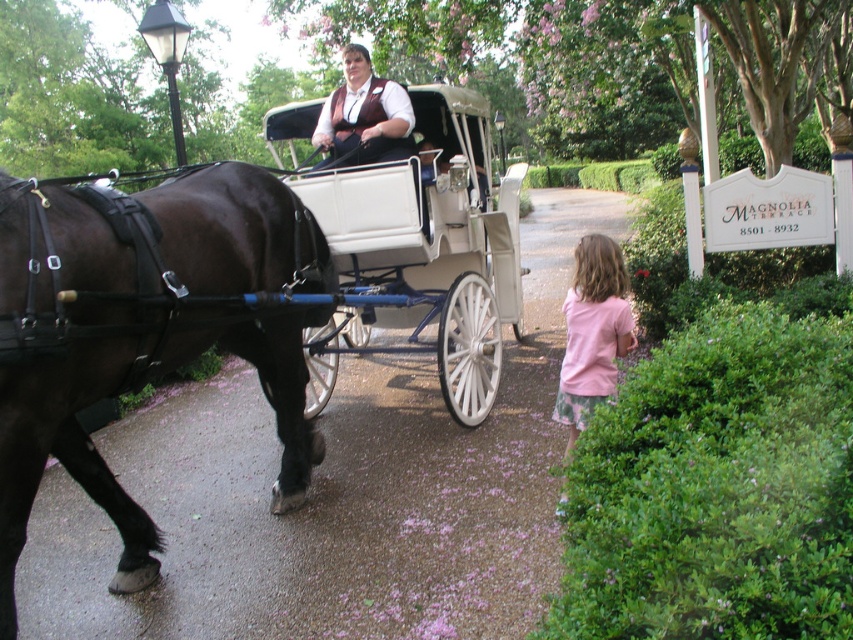
Does shiny black horse at left appear under pink cotton shirt at lower right?

No, shiny black horse at left is not below pink cotton shirt at lower right.

What do you see at coordinates (146, 330) in the screenshot? This screenshot has height=640, width=853. I see `shiny black horse at left` at bounding box center [146, 330].

Is point (157, 529) in front of point (619, 321)?

Yes.

The width and height of the screenshot is (853, 640). I want to click on shiny black horse at left, so 146,330.

Is pink cotton shirt at lower right to the left of matte brown vest at center from the viewer's perspective?

Incorrect, pink cotton shirt at lower right is not on the left side of matte brown vest at center.

Between pink cotton shirt at lower right and matte brown vest at center, which one appears on the left side from the viewer's perspective?

Positioned to the left is matte brown vest at center.

Is point (605, 333) closer to viewer compared to point (386, 132)?

Yes.

Find the location of a particular element. pink cotton shirt at lower right is located at coordinates (592, 332).

How far apart are shiny black horse at left and matte brown vest at center?

shiny black horse at left is 2.32 meters from matte brown vest at center.

How much distance is there between shiny black horse at left and matte brown vest at center?

They are 7.61 feet apart.

Between point (193, 253) and point (369, 120), which one is positioned behind?

The point (369, 120) is behind.

Locate an element on the screen. shiny black horse at left is located at coordinates (146, 330).